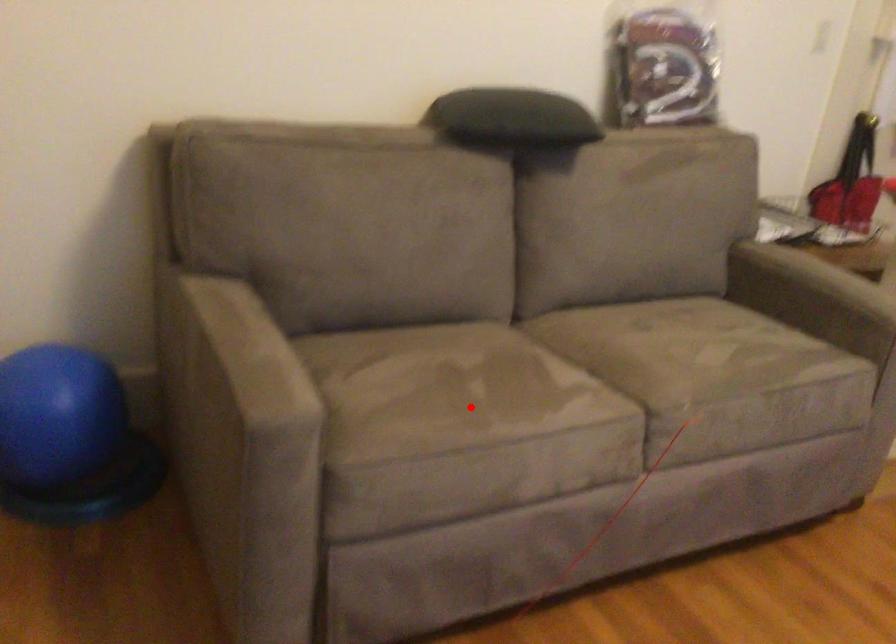
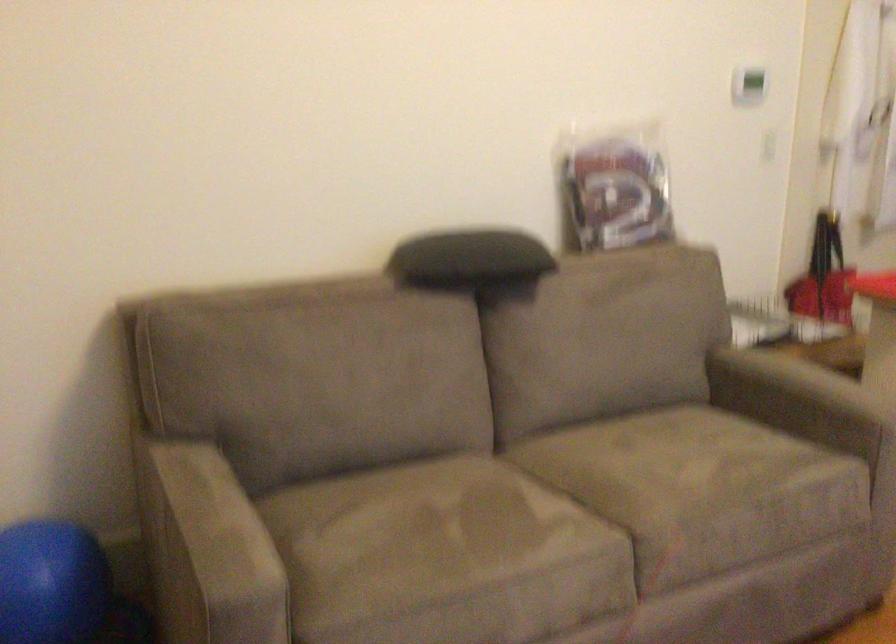
Find the pixel in the second image that matches the highlighted location in the first image.

(444, 556)